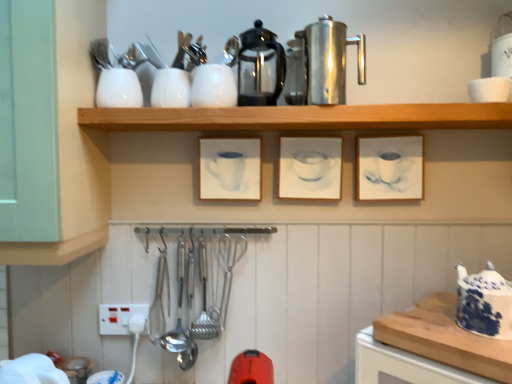
Question: Does wooden cutting board at lower right appear on the left side of wooden shelf at upper center?

Choices:
 (A) yes
 (B) no

Answer: (B)

Question: Does wooden cutting board at lower right lie in front of wooden shelf at upper center?

Choices:
 (A) no
 (B) yes

Answer: (B)

Question: From a real-world perspective, does wooden cutting board at lower right sit lower than wooden shelf at upper center?

Choices:
 (A) yes
 (B) no

Answer: (A)

Question: Is wooden cutting board at lower right further to the viewer compared to wooden shelf at upper center?

Choices:
 (A) yes
 (B) no

Answer: (B)

Question: Does wooden cutting board at lower right have a larger size compared to wooden shelf at upper center?

Choices:
 (A) no
 (B) yes

Answer: (A)

Question: From the image's perspective, is white glossy cup at upper left, positioned as the fourth tableware in right-to-left order, above or below shiny metallic coffeepot at upper right, which appears as the 2th coffeepot when viewed from the left?

Choices:
 (A) above
 (B) below

Answer: (B)

Question: Based on their positions, is white glossy cup at upper left, placed as the 1th tableware when sorted from left to right, located to the left or right of shiny metallic coffeepot at upper right, which appears as the 2th coffeepot when viewed from the left?

Choices:
 (A) left
 (B) right

Answer: (A)

Question: Considering their positions, is white glossy cup at upper left, positioned as the fourth tableware in right-to-left order, located in front of or behind shiny metallic coffeepot at upper right, which appears as the 2th coffeepot when viewed from the left?

Choices:
 (A) front
 (B) behind

Answer: (B)

Question: Considering the positions of white glossy cup at upper left, placed as the 1th tableware when sorted from left to right, and shiny metallic coffeepot at upper right, which appears as the 2th coffeepot when viewed from the left, in the image, is white glossy cup at upper left, placed as the 1th tableware when sorted from left to right, wider or thinner than shiny metallic coffeepot at upper right, which appears as the 2th coffeepot when viewed from the left,?

Choices:
 (A) thin
 (B) wide

Answer: (A)

Question: In the image, is white glossy bowl at upper right, positioned as the fourth tableware in left-to-right order, on the left side or the right side of glossy ceramic cup at center, positioned as the 2th picture frame in right-to-left order?

Choices:
 (A) left
 (B) right

Answer: (B)

Question: From the image's perspective, is white glossy bowl at upper right, the first tableware viewed from the right, located above or below glossy ceramic cup at center, which is the second picture frame in left-to-right order?

Choices:
 (A) above
 (B) below

Answer: (A)

Question: Is white glossy bowl at upper right, the first tableware viewed from the right, inside or outside of glossy ceramic cup at center, positioned as the 2th picture frame in right-to-left order?

Choices:
 (A) inside
 (B) outside

Answer: (B)

Question: Considering the positions of white glossy bowl at upper right, positioned as the fourth tableware in left-to-right order, and glossy ceramic cup at center, positioned as the 2th picture frame in right-to-left order, in the image, is white glossy bowl at upper right, positioned as the fourth tableware in left-to-right order, wider or thinner than glossy ceramic cup at center, positioned as the 2th picture frame in right-to-left order,?

Choices:
 (A) thin
 (B) wide

Answer: (B)

Question: Considering the positions of wooden cutting board at lower right and matte white frame at center right, which is the 3th picture frame from left to right, in the image, is wooden cutting board at lower right taller or shorter than matte white frame at center right, which is the 3th picture frame from left to right,?

Choices:
 (A) tall
 (B) short

Answer: (B)

Question: Is wooden cutting board at lower right wider or thinner than matte white frame at center right, which is the first picture frame from right to left?

Choices:
 (A) wide
 (B) thin

Answer: (A)